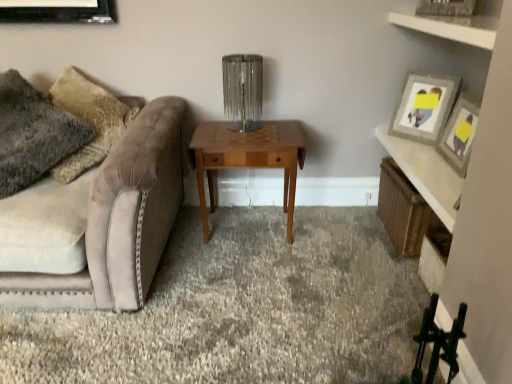
Describe the element at coordinates (33, 134) in the screenshot. This screenshot has height=384, width=512. I see `fuzzy fabric pillow at left` at that location.

Image resolution: width=512 pixels, height=384 pixels. Describe the element at coordinates (247, 158) in the screenshot. I see `wooden table at center` at that location.

Image resolution: width=512 pixels, height=384 pixels. Describe the element at coordinates (401, 210) in the screenshot. I see `woven wicker basket at right, placed as the 2th shelf when sorted from top to bottom` at that location.

This screenshot has height=384, width=512. Find the location of `clear glass table lamp at center`. clear glass table lamp at center is located at coordinates point(243,90).

Is white wood shelf at upper right, arranged as the 2th shelf when viewed from the back, oriented towards woven wicker basket at right, the first shelf positioned from the back?

No, white wood shelf at upper right, arranged as the 2th shelf when viewed from the back, is not facing towards woven wicker basket at right, the first shelf positioned from the back.

Where is `shelf that is in front of the woven wicker basket at right, marked as the first shelf in a bottom-to-top arrangement`? Image resolution: width=512 pixels, height=384 pixels. shelf that is in front of the woven wicker basket at right, marked as the first shelf in a bottom-to-top arrangement is located at coordinates (451, 27).

Does white wood shelf at upper right, the second shelf in the bottom-to-top sequence, have a larger size compared to woven wicker basket at right, the 2th shelf viewed from the front?

No.

Is white wood shelf at upper right, acting as the first shelf starting from the front, inside the boundaries of woven wicker basket at right, the 2th shelf viewed from the front, or outside?

white wood shelf at upper right, acting as the first shelf starting from the front, exists outside the volume of woven wicker basket at right, the 2th shelf viewed from the front.

Is wooden picture frame at upper right smaller than velvet beige couch at left?

Yes.

Which is farther from the camera, (419, 115) or (15, 199)?

The point (419, 115) is more distant.

From the picture: From a real-world perspective, is wooden picture frame at upper right physically located above or below velvet beige couch at left?

wooden picture frame at upper right is situated higher than velvet beige couch at left in the real world.

Is white wood shelf at upper right, acting as the first shelf starting from the front, aimed at velvet beige couch at left?

No, white wood shelf at upper right, acting as the first shelf starting from the front, is not oriented towards velvet beige couch at left.

Is white wood shelf at upper right, the second shelf in the bottom-to-top sequence, located outside velvet beige couch at left?

Yes, white wood shelf at upper right, the second shelf in the bottom-to-top sequence, is located beyond the bounds of velvet beige couch at left.

Is white wood shelf at upper right, acting as the first shelf starting from the front, directly adjacent to velvet beige couch at left?

No, white wood shelf at upper right, acting as the first shelf starting from the front, is not beside velvet beige couch at left.

Which is more to the left, white wood shelf at upper right, the second shelf in the bottom-to-top sequence, or velvet beige couch at left?

From the viewer's perspective, velvet beige couch at left appears more on the left side.

From the image's perspective, between woven wicker basket at right, marked as the first shelf in a bottom-to-top arrangement, and white wood shelf at upper right, the second shelf in the bottom-to-top sequence, which one is located above?

From the image's view, white wood shelf at upper right, the second shelf in the bottom-to-top sequence, is above.

Is point (391, 178) closer to viewer compared to point (406, 14)?

That is False.

Would you consider woven wicker basket at right, the first shelf positioned from the back, to be distant from white wood shelf at upper right, acting as the first shelf starting from the front?

They are positioned close to each other.

How much distance is there between wooden table at center and carpet at center?

wooden table at center is 54.91 centimeters from carpet at center.

Looking at their sizes, would you say wooden table at center is wider or thinner than carpet at center?

In the image, wooden table at center appears to be more narrow than carpet at center.

Is wooden table at center situated inside carpet at center or outside?

wooden table at center cannot be found inside carpet at center.

Can you tell me how much wooden table at center and carpet at center differ in facing direction?

91 degrees.

Is point (26, 123) positioned after point (396, 164)?

No, (26, 123) is in front of (396, 164).

Is fuzzy fabric pillow at left completely or partially outside of woven wicker basket at right, placed as the 2th shelf when sorted from top to bottom?

Yes, fuzzy fabric pillow at left is outside of woven wicker basket at right, placed as the 2th shelf when sorted from top to bottom.

The width and height of the screenshot is (512, 384). I want to click on pillow above the woven wicker basket at right, placed as the 2th shelf when sorted from top to bottom (from a real-world perspective), so click(x=33, y=134).

Which of these two, fuzzy fabric pillow at left or woven wicker basket at right, the 2th shelf viewed from the front, stands shorter?

With less height is woven wicker basket at right, the 2th shelf viewed from the front.

Is wooden picture frame at upper right not within white wood shelf at upper right, the second shelf in the bottom-to-top sequence?

Yes, wooden picture frame at upper right is outside of white wood shelf at upper right, the second shelf in the bottom-to-top sequence.

Between wooden picture frame at upper right and white wood shelf at upper right, arranged as the 2th shelf when viewed from the back, which one has less height?

With less height is white wood shelf at upper right, arranged as the 2th shelf when viewed from the back.

Can you confirm if wooden picture frame at upper right is bigger than white wood shelf at upper right, which is the first shelf from top to bottom?

No.

Which is more to the left, wooden picture frame at upper right or white wood shelf at upper right, acting as the first shelf starting from the front?

white wood shelf at upper right, acting as the first shelf starting from the front, is more to the left.

I want to click on shelf above the woven wicker basket at right, placed as the 2th shelf when sorted from top to bottom (from the image's perspective), so click(451, 27).

The image size is (512, 384). What are the coordinates of `picture frame that is on the right side of velvet beige couch at left` in the screenshot? It's located at (424, 107).

Looking at the image, which one is located further to carpet at center, wooden picture frame at upper right or white wood shelf at upper right, acting as the first shelf starting from the front?

The object further to carpet at center is white wood shelf at upper right, acting as the first shelf starting from the front.

Which object lies nearer to the anchor point carpet at center, wooden table at center or velvet beige couch at left?

Among the two, velvet beige couch at left is located nearer to carpet at center.

Based on their spatial positions, is woven wicker basket at right, placed as the 2th shelf when sorted from top to bottom, or clear glass table lamp at center closer to wooden table at center?

Based on the image, clear glass table lamp at center appears to be nearer to wooden table at center.

Based on their spatial positions, is carpet at center or white wood shelf at upper right, acting as the first shelf starting from the front, further from clear glass table lamp at center?

carpet at center.

Looking at the image, which one is located closer to woven wicker basket at right, marked as the first shelf in a bottom-to-top arrangement, carpet at center or white wood shelf at upper right, which is the first shelf from top to bottom?

The object closer to woven wicker basket at right, marked as the first shelf in a bottom-to-top arrangement, is carpet at center.

Estimate the real-world distances between objects in this image. Which object is further from velvet beige couch at left, wooden picture frame at upper right or woven wicker basket at right, the first shelf positioned from the back?

wooden picture frame at upper right lies further to velvet beige couch at left than the other object.

Based on their spatial positions, is carpet at center or wooden picture frame at upper right further from wooden table at center?

The object further to wooden table at center is wooden picture frame at upper right.

Which object lies nearer to the anchor point white wood shelf at upper right, which is the first shelf from top to bottom, fuzzy fabric pillow at left or velvet beige couch at left?

velvet beige couch at left is positioned closer to the anchor white wood shelf at upper right, which is the first shelf from top to bottom.

Find the location of `shelf positioned between white wood shelf at upper right, the second shelf in the bottom-to-top sequence, and wooden picture frame at upper right from near to far`. shelf positioned between white wood shelf at upper right, the second shelf in the bottom-to-top sequence, and wooden picture frame at upper right from near to far is located at coordinates (401, 210).

The width and height of the screenshot is (512, 384). What are the coordinates of `plain between velvet beige couch at left and wooden table at center from left to right` in the screenshot? It's located at (242, 309).

At what (x,y) coordinates should I click in order to perform the action: click on table lamp between carpet at center and wooden picture frame at upper right from left to right. Please return your answer as a coordinate pair (x, y). This screenshot has height=384, width=512. Looking at the image, I should click on (243, 90).

The height and width of the screenshot is (384, 512). In order to click on plain situated between fuzzy fabric pillow at left and wooden picture frame at upper right from left to right in this screenshot , I will do `click(242, 309)`.